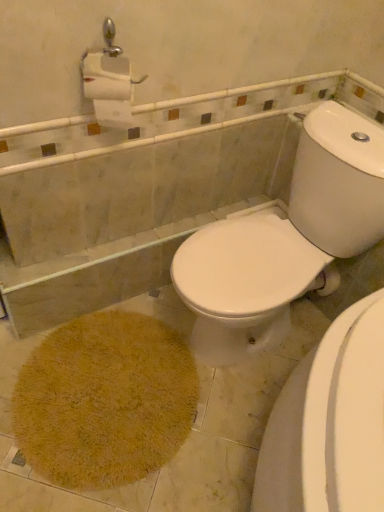
Identify the location of free space below yellow shaggy bath mat at lower left (from a real-world perspective). This screenshot has width=384, height=512. (111, 400).